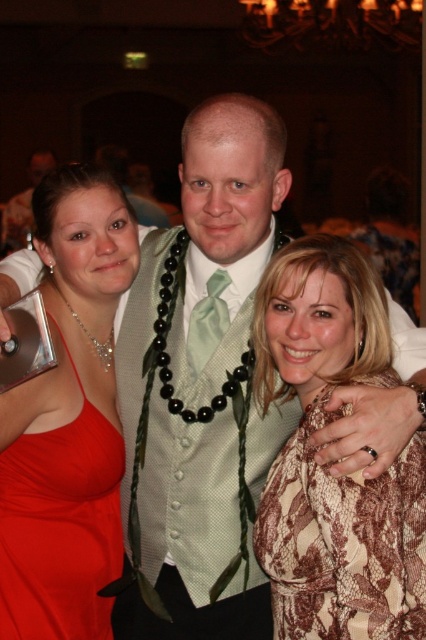
Question: Is brown textured dress at center positioned in front of matte red dress at left?

Choices:
 (A) no
 (B) yes

Answer: (B)

Question: Which point is farther to the camera?

Choices:
 (A) matte red dress at left
 (B) brown textured dress at center

Answer: (A)

Question: Which is farther from the matte red dress at left?

Choices:
 (A) brown textured dress at center
 (B) satin green tie at center

Answer: (A)

Question: Which is nearer to the matte red dress at left?

Choices:
 (A) satin green tie at center
 (B) brown textured dress at center

Answer: (A)

Question: Is brown textured dress at center smaller than matte red dress at left?

Choices:
 (A) yes
 (B) no

Answer: (B)

Question: Considering the relative positions of brown textured dress at center and satin green tie at center in the image provided, where is brown textured dress at center located with respect to satin green tie at center?

Choices:
 (A) below
 (B) above

Answer: (A)